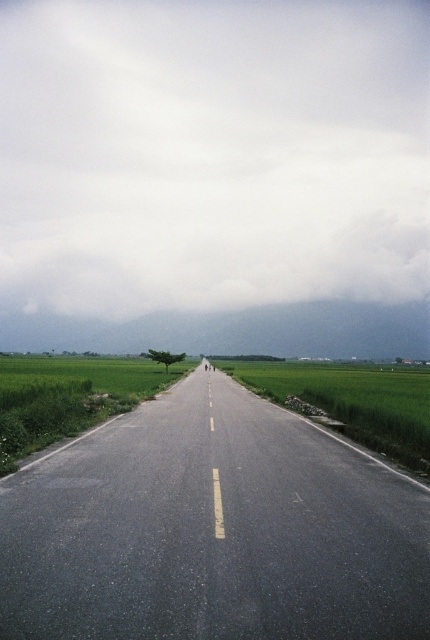
Can you confirm if asphalt road at center is taller than green grass at center?

No.

Which is more to the right, asphalt road at center or green grass at center?

From the viewer's perspective, asphalt road at center appears more on the right side.

You are a GUI agent. You are given a task and a screenshot of the screen. Output one action in this format:
    pyautogui.click(x=<x>, y=<y>)
    Task: Click on the asphalt road at center
    The image size is (430, 640).
    Given the screenshot: What is the action you would take?
    pyautogui.click(x=212, y=531)

Which is above, white fluffy cloud at upper center or green grassy rice field at center?

Positioned higher is white fluffy cloud at upper center.

Which is behind, point (51, 301) or point (350, 400)?

Point (51, 301)

The width and height of the screenshot is (430, 640). In order to click on white fluffy cloud at upper center in this screenshot , I will do `click(211, 152)`.

Which is more to the left, asphalt road at center or green grassy rice field at center?

Positioned to the left is asphalt road at center.

Is asphalt road at center below green grassy rice field at center?

Incorrect, asphalt road at center is not positioned below green grassy rice field at center.

Which is behind, point (280, 448) or point (246, 372)?

Point (246, 372)

Locate an element on the screen. asphalt road at center is located at coordinates (212, 531).